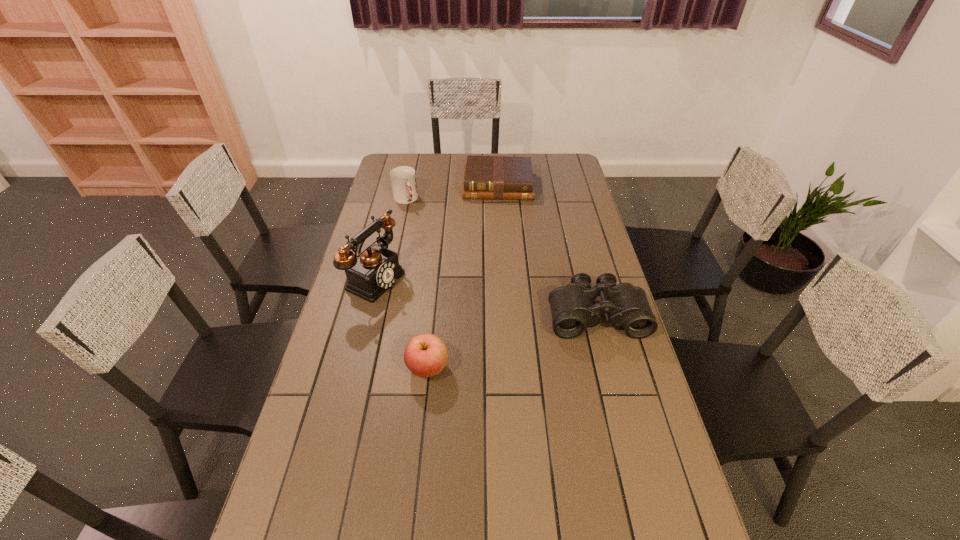
In order to click on vacant spot on the desktop that is between the nearest object and the binoculars and is positioned on the spine side of the shortest object in this screenshot , I will do `click(499, 345)`.

The image size is (960, 540). In order to click on free spot on the desktop that is between the nearest object and the binoculars and is positioned on the handle side of the cup in this screenshot , I will do `click(496, 346)`.

The height and width of the screenshot is (540, 960). I want to click on free space on the desktop that is between the nearest object and the binoculars and is positioned on the front of the tallest object at the rotary dial, so tap(516, 340).